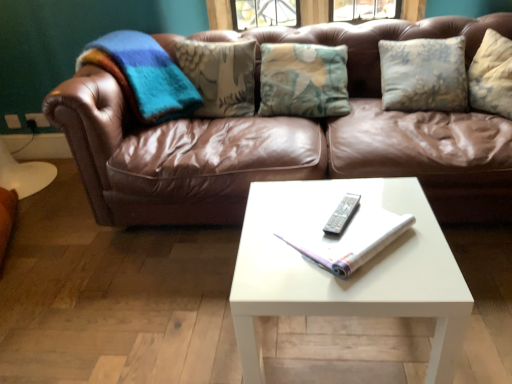
Identify the location of free spot behind white paper book at center. Image resolution: width=512 pixels, height=384 pixels. (313, 197).